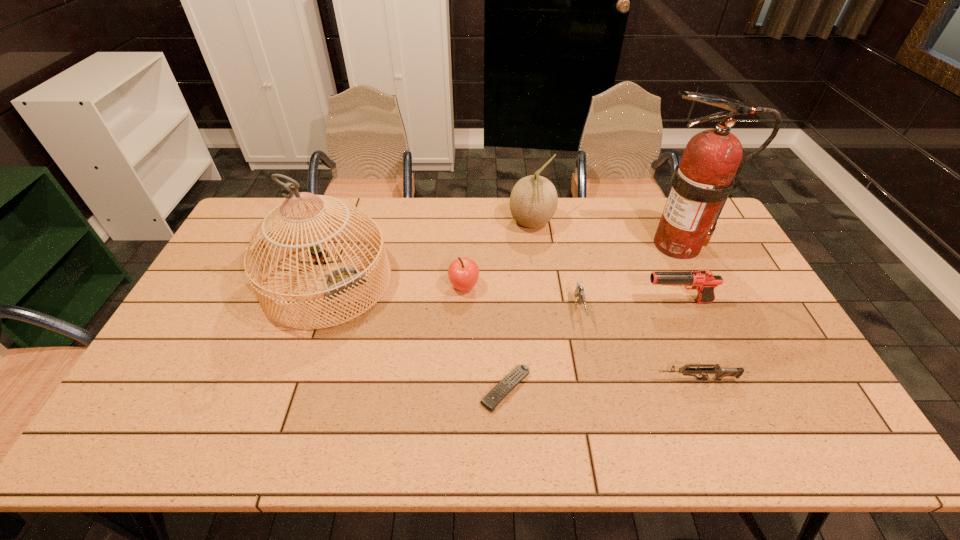
The height and width of the screenshot is (540, 960). In the image, there is a desktop. In order to click on free space at the far edge in this screenshot , I will do `click(385, 229)`.

Image resolution: width=960 pixels, height=540 pixels. In the image, there is a desktop. What are the coordinates of `vacant space at the near edge` in the screenshot? It's located at (457, 424).

Identify the location of unoccupied position between the tallest gun and the shortest object. Image resolution: width=960 pixels, height=540 pixels. (591, 346).

Where is `free spot between the shortest gun and the second object from left to right`? free spot between the shortest gun and the second object from left to right is located at coordinates (580, 333).

Where is `vacant area between the seventh object from right to left and the shortest gun`? The width and height of the screenshot is (960, 540). vacant area between the seventh object from right to left and the shortest gun is located at coordinates (580, 333).

Where is `free space between the tallest gun and the leftmost gun`? Image resolution: width=960 pixels, height=540 pixels. free space between the tallest gun and the leftmost gun is located at coordinates (628, 307).

This screenshot has width=960, height=540. In order to click on vacant area that lies between the sixth shortest object and the fire extinguisher in this screenshot , I will do `click(605, 234)`.

In order to click on vacant area that lies between the cantaloup and the fire extinguisher in this screenshot , I will do `click(605, 234)`.

You are a GUI agent. You are given a task and a screenshot of the screen. Output one action in this format:
    pyautogui.click(x=<x>, y=<y>)
    Task: Click on the vacant space in between the shortest object and the leftmost gun
    The height and width of the screenshot is (540, 960).
    Given the screenshot: What is the action you would take?
    pyautogui.click(x=542, y=350)

Where is `free space between the seventh tallest object and the second object from left to right`? The height and width of the screenshot is (540, 960). free space between the seventh tallest object and the second object from left to right is located at coordinates coord(580,333).